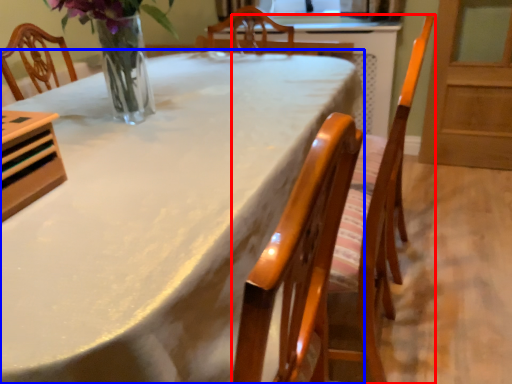
Question: Which point is further to the camera, chair (highlighted by a red box) or table (highlighted by a blue box)?

Choices:
 (A) chair
 (B) table

Answer: (A)